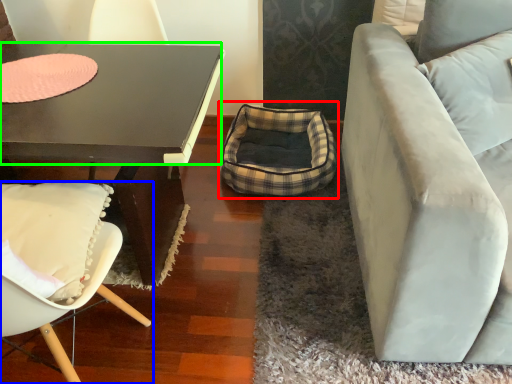
Question: Which object is positioned farthest from bean bag chair (highlighted by a red box)? Select from chair (highlighted by a blue box) and glass table (highlighted by a green box).

Choices:
 (A) chair
 (B) glass table

Answer: (A)